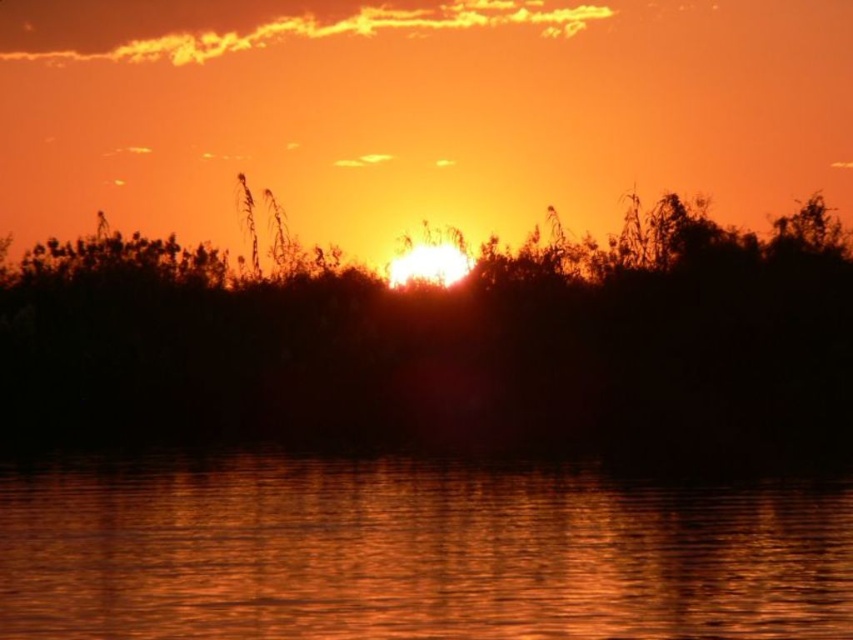
This screenshot has width=853, height=640. What do you see at coordinates (448, 344) in the screenshot?
I see `silhouette leafy tree at center` at bounding box center [448, 344].

Does silhouette leafy tree at center have a smaller size compared to glistening water at center?

No.

Who is more forward, (759, 241) or (550, 492)?

Positioned in front is point (550, 492).

The height and width of the screenshot is (640, 853). I want to click on silhouette leafy tree at center, so click(448, 344).